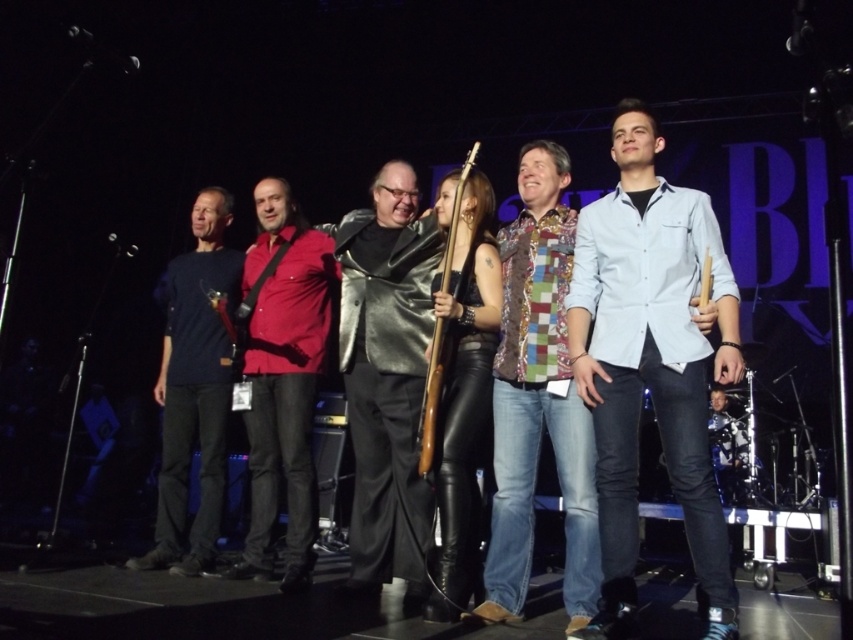
Question: Estimate the real-world distances between objects in this image. Which object is closer to the matte red shirt at center?

Choices:
 (A) light blue denim shirt at center
 (B) shiny black guitar at center
 (C) dark blue t-shirt at left
 (D) multicolored patchwork shirt at center

Answer: (C)

Question: From the image, what is the correct spatial relationship of shiny black guitar at center in relation to matte red shirt at center?

Choices:
 (A) below
 (B) above

Answer: (B)

Question: Which of the following is the closest to the observer?

Choices:
 (A) multicolored patchwork shirt at center
 (B) light blue denim shirt at center
 (C) dark blue t-shirt at left
 (D) matte red shirt at center

Answer: (B)

Question: Is shiny black guitar at center further to the viewer compared to dark blue t-shirt at left?

Choices:
 (A) no
 (B) yes

Answer: (A)

Question: Does light blue denim shirt at center have a lesser width compared to dark blue t-shirt at left?

Choices:
 (A) yes
 (B) no

Answer: (B)

Question: Which of the following is the closest to the observer?

Choices:
 (A) light blue denim shirt at center
 (B) dark blue t-shirt at left
 (C) multicolored patchwork shirt at center
 (D) matte red shirt at center

Answer: (A)